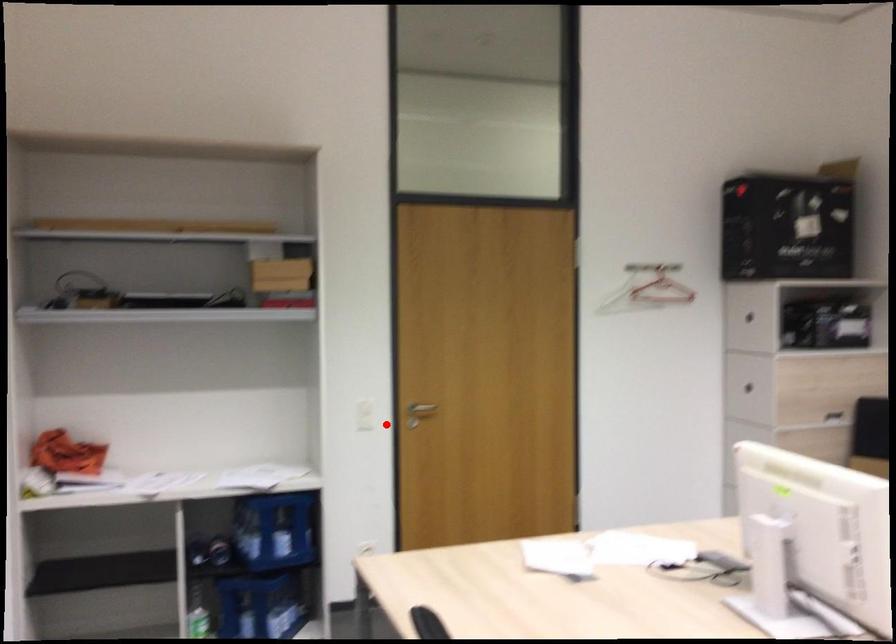
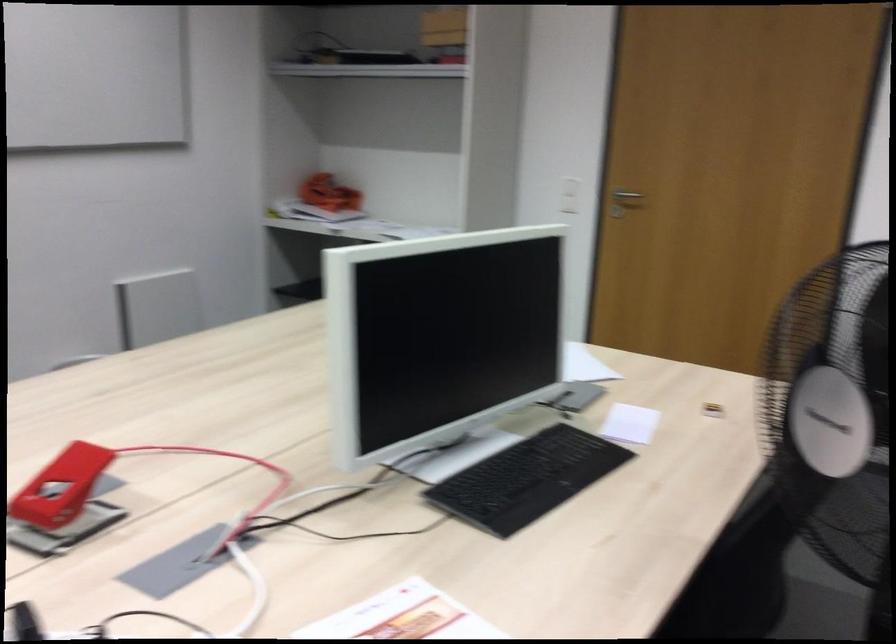
Question: I am providing you with two images of the same scene from different viewpoints. Image1 has a red point marked. In image2, the corresponding 3D location appears at what relative position? Reply with the corresponding letter.

Choices:
 (A) Closer
 (B) Farther

Answer: (A)